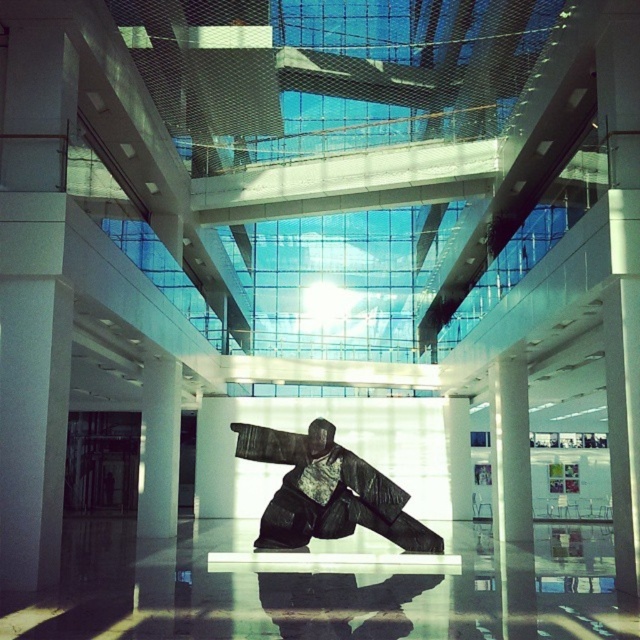
You are standing in the modern architectural interior space described. You want to place a new decorative item exactly at the point marked as point (326, 492). What object is currently occupying that location?

The dark brown wood statue at center is located at point (326, 492), so that location is currently occupied by the dark brown wood statue at center.

You are an art curator planning to install a new lighting system in the gallery. The statue is placed on a pillar. To ensure the statue is properly illuminated, you need to know if the pillar is directly under the statue. Is the dark brown wood statue at center positioned over the white glossy pillar at center?

Yes, the dark brown wood statue at center is positioned over the white glossy pillar at center, so the pillar is directly under the statue.